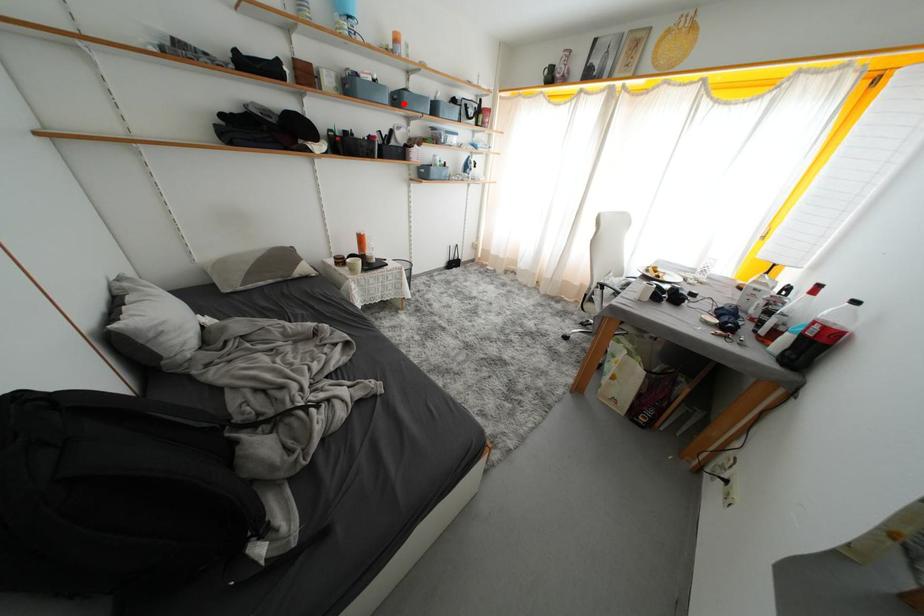
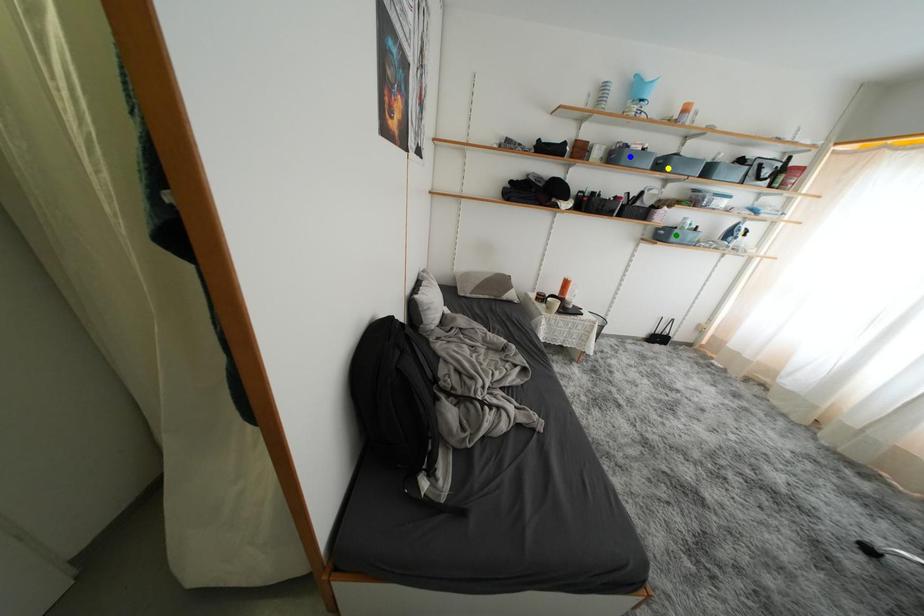
Question: I am providing you with two images of the same scene from different viewpoints. A red point is marked on the first image. You are given multiple points on the second image. In image 2, which mark is for the same physical point as the one in image 1?

Choices:
 (A) yellow point
 (B) green point
 (C) blue point

Answer: (A)